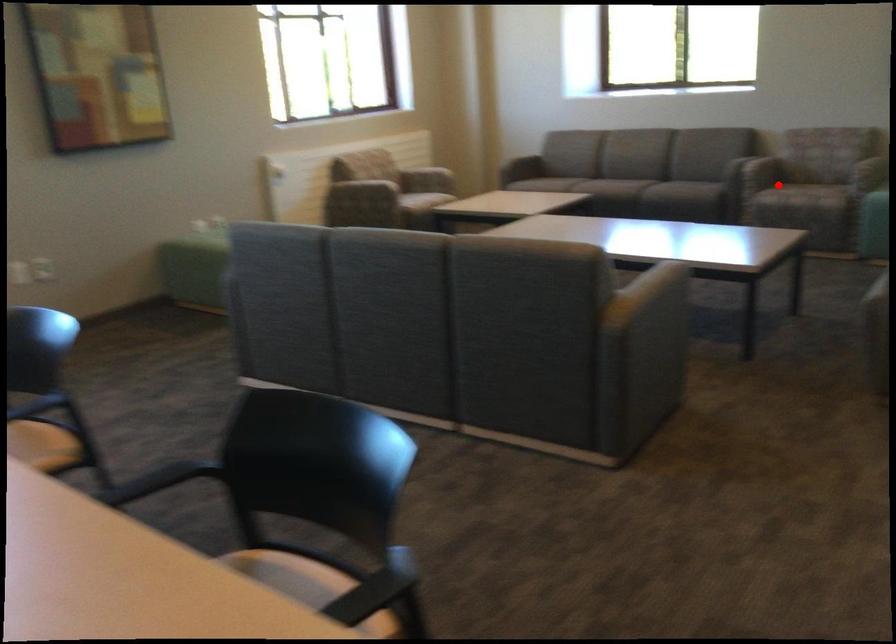
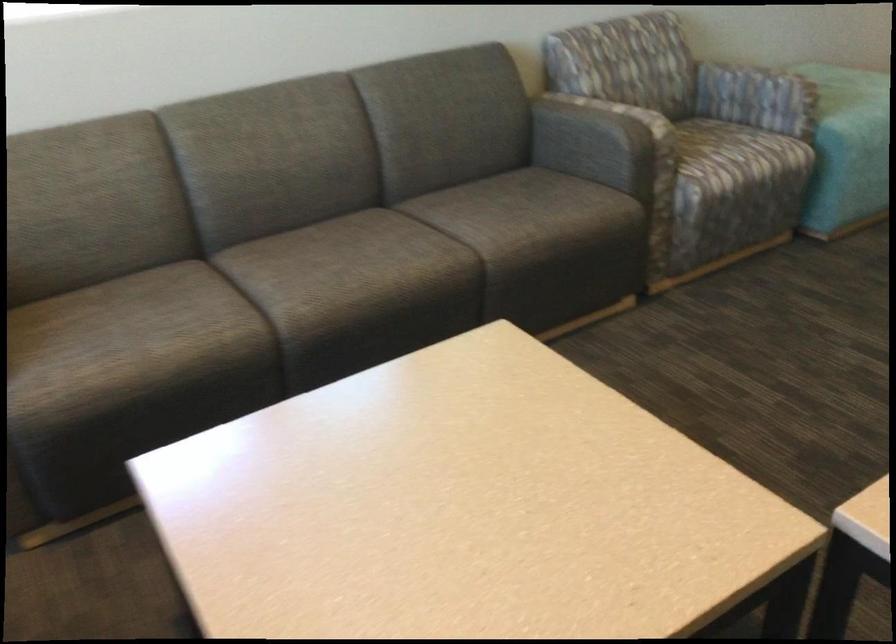
Find the pixel in the second image that matches the highlighted location in the first image.

(737, 155)